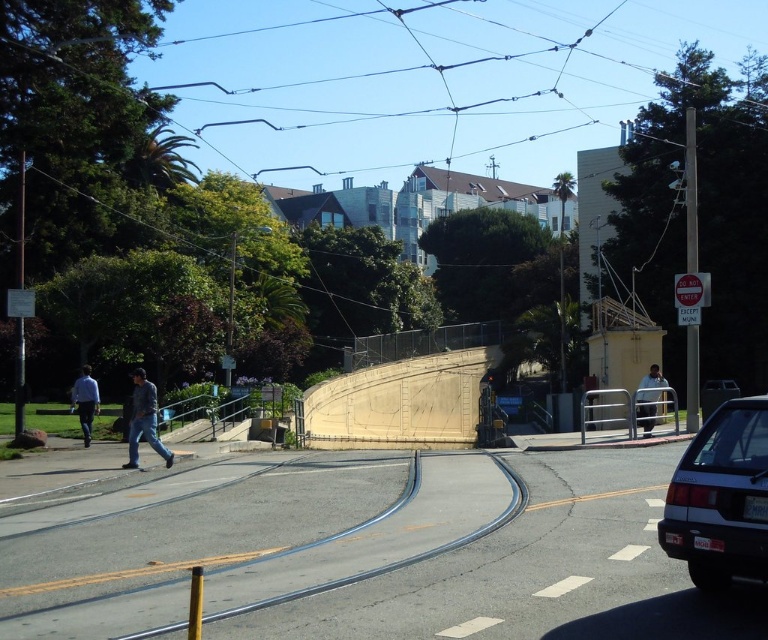
Does metallic wire at upper center appear over black fabric bag at center?

Yes.

You are a GUI agent. You are given a task and a screenshot of the screen. Output one action in this format:
    pyautogui.click(x=<x>, y=<y>)
    Task: Click on the metallic wire at upper center
    The width and height of the screenshot is (768, 640).
    Given the screenshot: What is the action you would take?
    pyautogui.click(x=425, y=77)

This screenshot has height=640, width=768. I want to click on metallic wire at upper center, so click(x=425, y=77).

Does denim jeans at lower left have a lesser height compared to light blue shirt at left?

Indeed, denim jeans at lower left has a lesser height compared to light blue shirt at left.

Find the location of a particular element. denim jeans at lower left is located at coordinates (144, 420).

Where is `denim jeans at lower left`? The width and height of the screenshot is (768, 640). denim jeans at lower left is located at coordinates (144, 420).

Does white matte car at lower right have a lesser height compared to light blue shirt at left?

Yes, white matte car at lower right is shorter than light blue shirt at left.

Is white matte car at lower right positioned in front of light blue shirt at left?

Yes, white matte car at lower right is closer to the viewer.

Is point (690, 445) positioned before point (93, 390)?

Yes, point (690, 445) is in front of point (93, 390).

The width and height of the screenshot is (768, 640). In order to click on white matte car at lower right in this screenshot , I will do `click(720, 497)`.